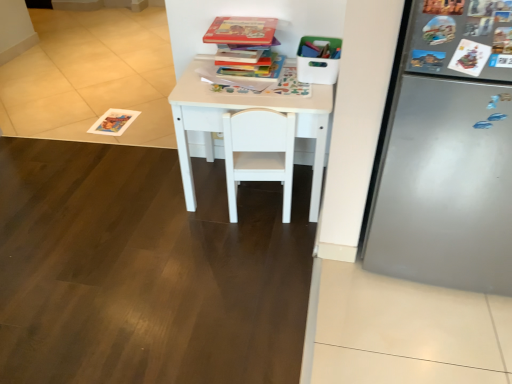
Where is `empty space that is ontop of white matte chair at center (from a real-world perspective)`? empty space that is ontop of white matte chair at center (from a real-world perspective) is located at coordinates (250, 87).